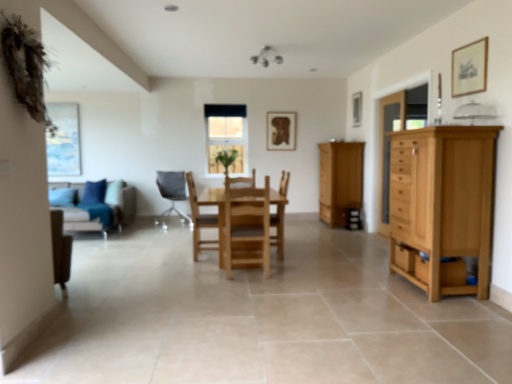
Question: Does light brown wooden table at center have a smaller size compared to light brown wood cabinet at center right?

Choices:
 (A) no
 (B) yes

Answer: (A)

Question: Is light brown wooden table at center bigger than light brown wood cabinet at center right?

Choices:
 (A) yes
 (B) no

Answer: (A)

Question: Does light brown wooden table at center appear on the right side of light brown wood cabinet at center right?

Choices:
 (A) no
 (B) yes

Answer: (A)

Question: Does light brown wooden table at center have a greater width compared to light brown wood cabinet at center right?

Choices:
 (A) yes
 (B) no

Answer: (A)

Question: Is light brown wooden table at center oriented towards light brown wood cabinet at center right?

Choices:
 (A) yes
 (B) no

Answer: (B)

Question: Is light brown wood cabinet at center right a part of light brown wooden table at center?

Choices:
 (A) yes
 (B) no

Answer: (B)

Question: Could light brown wooden table at center be considered to be inside wooden picture frame at upper center, which is the 3th picture frame from right to left?

Choices:
 (A) yes
 (B) no

Answer: (B)

Question: Is the position of wooden picture frame at upper center, marked as the 1th picture frame in a back-to-front arrangement, more distant than that of light brown wooden table at center?

Choices:
 (A) no
 (B) yes

Answer: (B)

Question: From a real-world perspective, is wooden picture frame at upper center, which is the 3th picture frame from right to left, under light brown wooden table at center?

Choices:
 (A) no
 (B) yes

Answer: (A)

Question: Is light brown wooden table at center at the back of wooden picture frame at upper center, marked as the 1th picture frame in a back-to-front arrangement?

Choices:
 (A) no
 (B) yes

Answer: (A)

Question: From the image's perspective, is wooden picture frame at upper center, which is the 1th picture frame in left-to-right order, over light brown wooden table at center?

Choices:
 (A) no
 (B) yes

Answer: (B)

Question: Considering the relative positions of wooden picture frame at upper center, marked as the 1th picture frame in a back-to-front arrangement, and light brown wooden table at center in the image provided, is wooden picture frame at upper center, marked as the 1th picture frame in a back-to-front arrangement, to the left of light brown wooden table at center from the viewer's perspective?

Choices:
 (A) yes
 (B) no

Answer: (B)

Question: Is light brown wood cabinet at center right a part of green leafy plant at center?

Choices:
 (A) no
 (B) yes

Answer: (A)